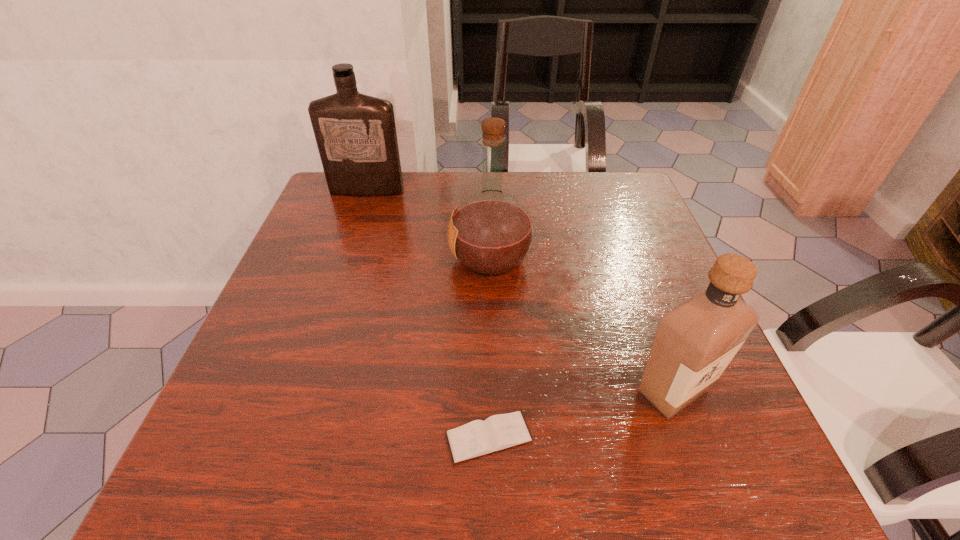
Locate an element on the screen. This screenshot has width=960, height=540. free spot between the second liquor from right to left and the nearest liquor is located at coordinates (582, 324).

At what (x,y) coordinates should I click in order to perform the action: click on vacant region between the second farthest liquor and the farthest object. Please return your answer as a coordinate pair (x, y). The height and width of the screenshot is (540, 960). Looking at the image, I should click on (429, 225).

The image size is (960, 540). Identify the location of vacant space that's between the rightmost liquor and the shortest object. (581, 414).

Identify which object is the third nearest to the farthest liquor. Please provide its 2D coordinates. Your answer should be formatted as a tuple, i.e. [(x, y)], where the tuple contains the x and y coordinates of a point satisfying the conditions above.

[(694, 342)]

Locate which object ranks second in proximity to the diary. Please provide its 2D coordinates. Your answer should be formatted as a tuple, i.e. [(x, y)], where the tuple contains the x and y coordinates of a point satisfying the conditions above.

[(491, 232)]

Identify which liquor is located as the second nearest to the rightmost object. Please provide its 2D coordinates. Your answer should be formatted as a tuple, i.e. [(x, y)], where the tuple contains the x and y coordinates of a point satisfying the conditions above.

[(355, 133)]

This screenshot has height=540, width=960. Find the location of `liquor object that ranks as the closest to the diary`. liquor object that ranks as the closest to the diary is located at coordinates (694, 342).

Where is `free space that satisfies the following two spatial constraints: 1. on the front label of the third nearest object; 2. on the front side of the diary`? The width and height of the screenshot is (960, 540). free space that satisfies the following two spatial constraints: 1. on the front label of the third nearest object; 2. on the front side of the diary is located at coordinates 495,437.

Locate an element on the screen. This screenshot has width=960, height=540. free spot that satisfies the following two spatial constraints: 1. on the label side of the shortest object; 2. on the right side of the leftmost liquor is located at coordinates (281, 437).

Find the location of a particular element. The height and width of the screenshot is (540, 960). vacant space that satisfies the following two spatial constraints: 1. on the label side of the diary; 2. on the left side of the leftmost object is located at coordinates (281, 437).